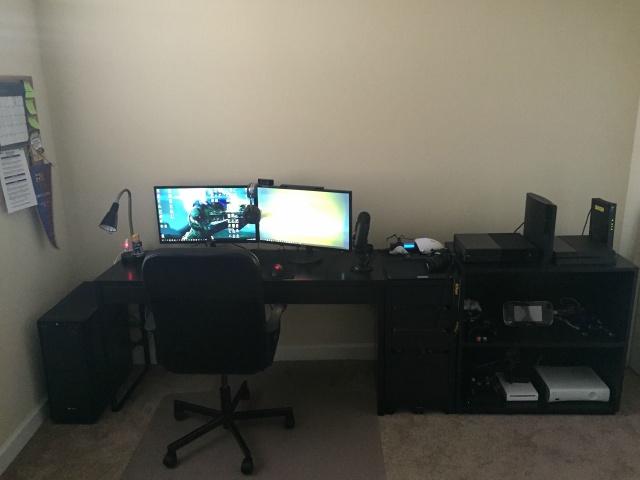
This screenshot has height=480, width=640. In order to click on chair mat in this screenshot , I will do `click(321, 432)`.